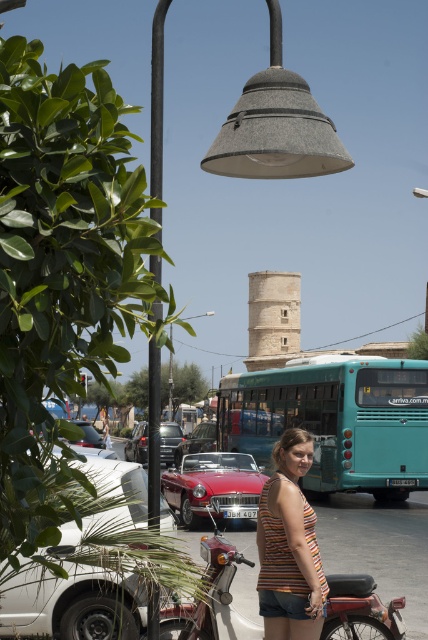
You are a photographer trying to capture the woman in the scene. The striped fabric tank top at center and metallic gray streetlight at upper center are both in the frame. Which object is positioned higher in the image?

The metallic gray streetlight at upper center is positioned higher in the image than the striped fabric tank top at center because the description states that the tank top is located below the streetlight.